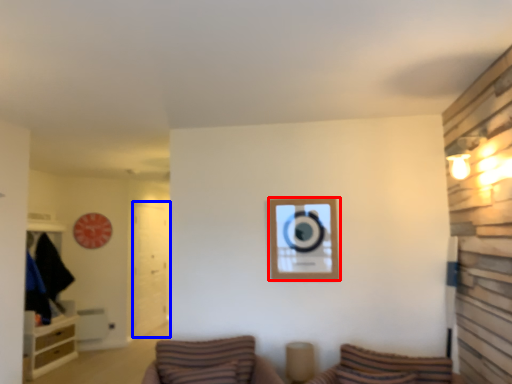
Question: Which point is closer to the camera, picture frame (highlighted by a red box) or glass door (highlighted by a blue box)?

Choices:
 (A) picture frame
 (B) glass door

Answer: (A)